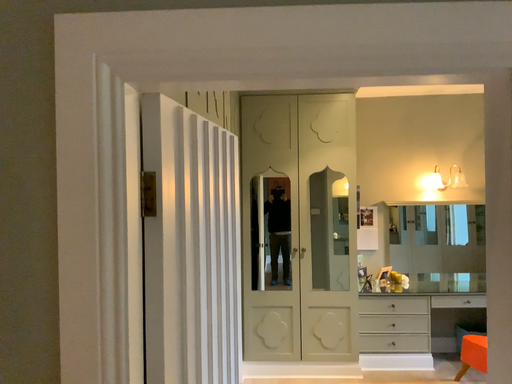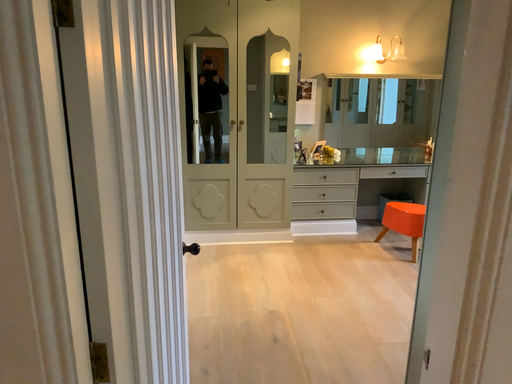
Question: Which way did the camera rotate in the video?

Choices:
 (A) rotated downward
 (B) rotated upward

Answer: (A)